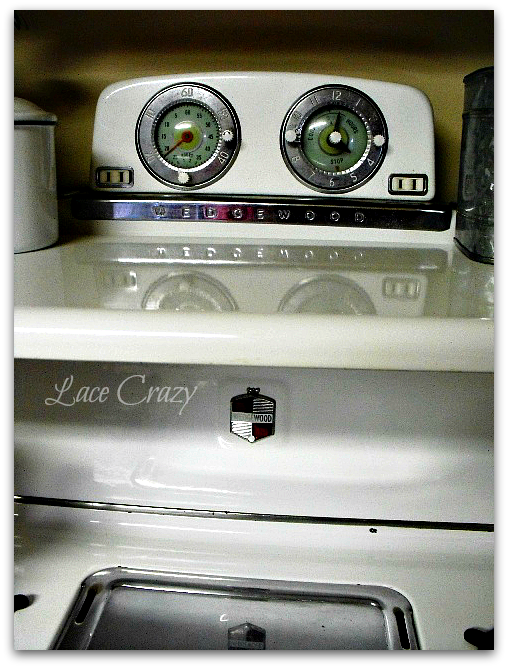
Image resolution: width=508 pixels, height=668 pixels. What are the coordinates of `white surface` in the screenshot? It's located at (253, 305).